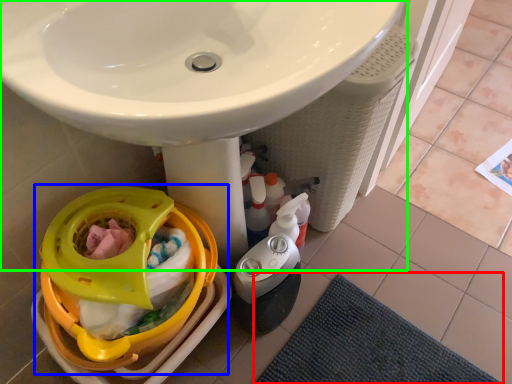
Question: Estimate the real-world distances between objects in this image. Which object is farther from bath mat (highlighted by a red box), baby carriage (highlighted by a blue box) or sink (highlighted by a green box)?

Choices:
 (A) baby carriage
 (B) sink

Answer: (B)